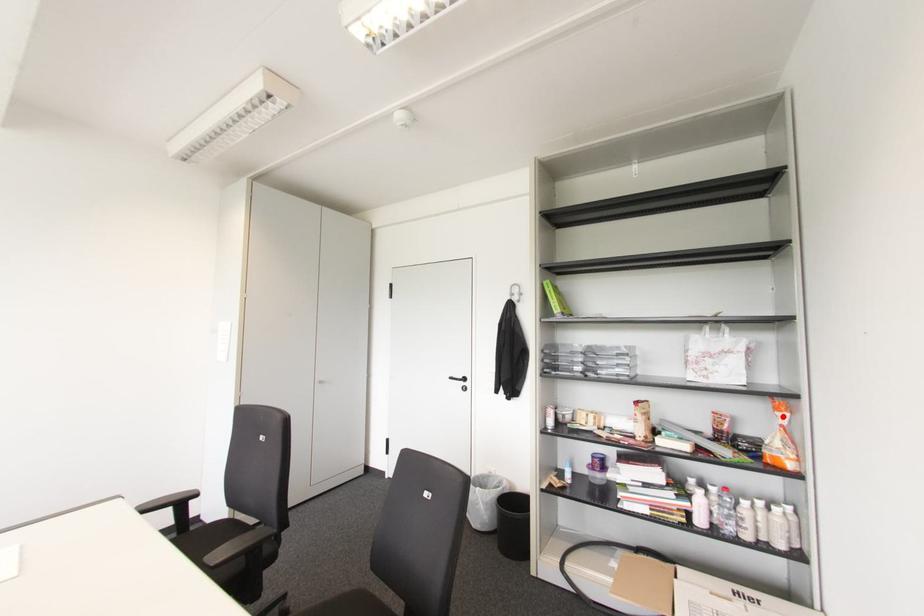
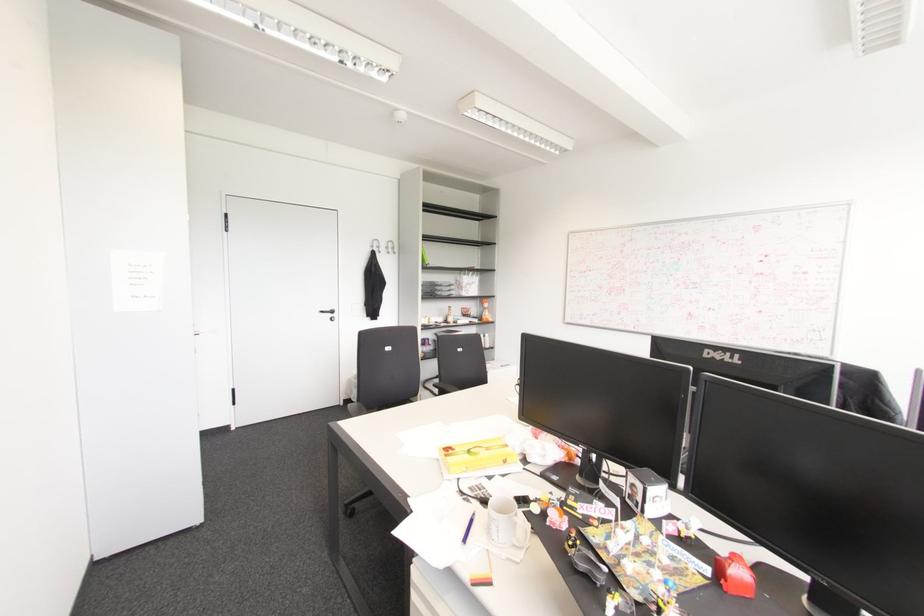
Where in the second image is the point corresponding to the highlighted location from the first image?

(485, 305)